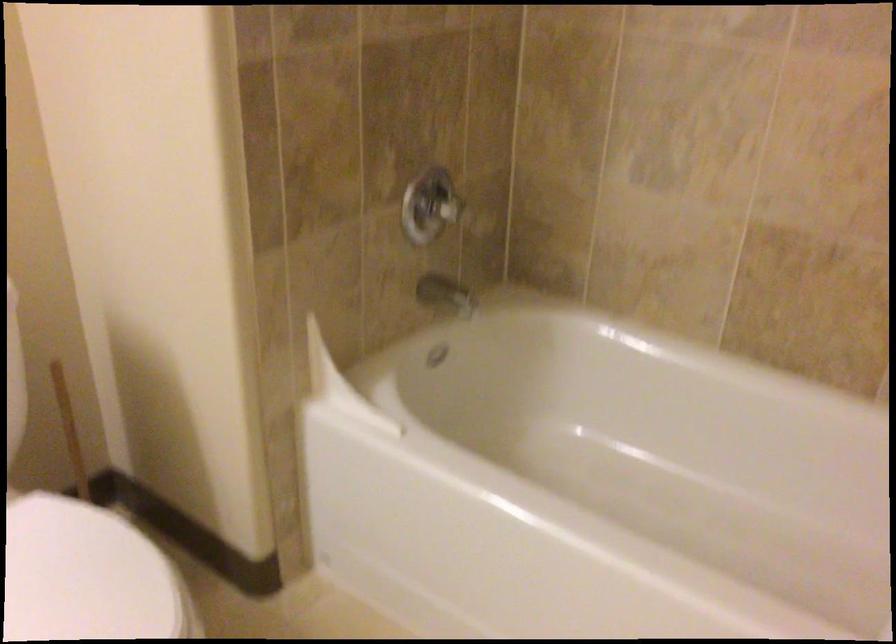
I want to click on chrome shower handle, so click(x=428, y=205).